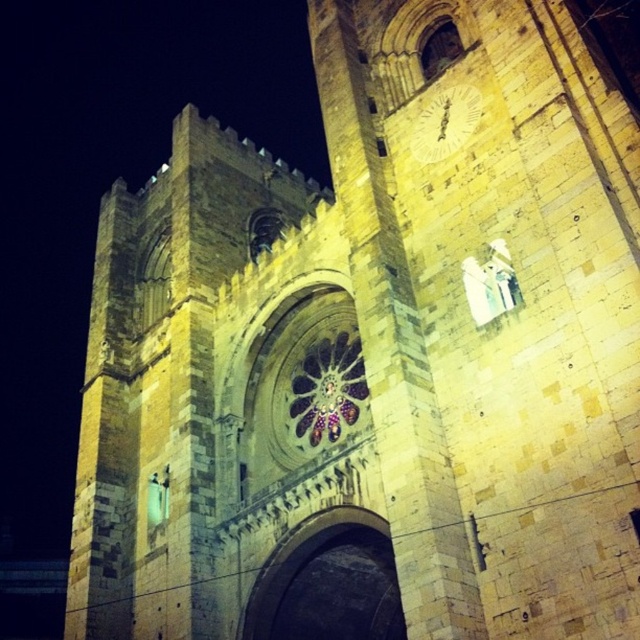
Does dark stone archway at center have a lesser width compared to white glossy clock at upper center?

No.

Identify the location of dark stone archway at center. The height and width of the screenshot is (640, 640). (328, 582).

Locate an element on the screen. This screenshot has width=640, height=640. dark stone archway at center is located at coordinates (328, 582).